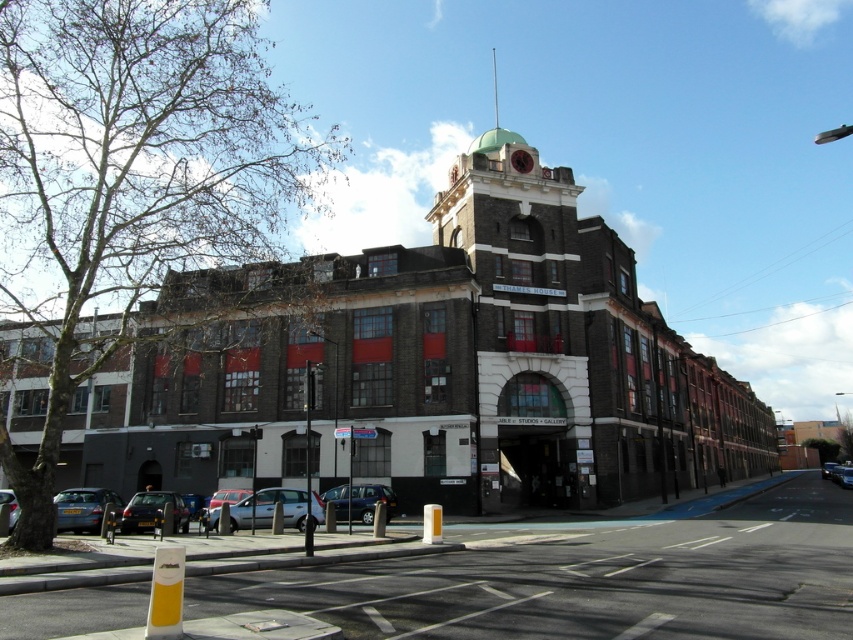
Can you confirm if silver metallic car at center is smaller than black matte car at lower left?

Yes, silver metallic car at center is smaller than black matte car at lower left.

Measure the distance between silver metallic car at center and black matte car at lower left.

A distance of 14.94 feet exists between silver metallic car at center and black matte car at lower left.

Is point (286, 492) positioned in front of point (129, 531)?

No.

Locate an element on the screen. Image resolution: width=853 pixels, height=640 pixels. silver metallic car at center is located at coordinates (270, 508).

Does point (247, 508) come behind point (361, 500)?

No, it is not.

Consider the image. Is matte black car at lower center positioned at the back of metallic silver van at center?

That is False.

Is point (216, 516) less distant than point (352, 508)?

Yes, point (216, 516) is in front of point (352, 508).

At what (x,y) coordinates should I click in order to perform the action: click on matte black car at lower center. Please return your answer as a coordinate pair (x, y). This screenshot has height=640, width=853. Looking at the image, I should click on (270, 508).

Who is lower down, metallic blue car at lower left or silver metallic car at lower left?

Positioned lower is silver metallic car at lower left.

Locate an element on the screen. The width and height of the screenshot is (853, 640). metallic blue car at lower left is located at coordinates (83, 508).

Locate an element on the screen. The image size is (853, 640). metallic blue car at lower left is located at coordinates (83, 508).